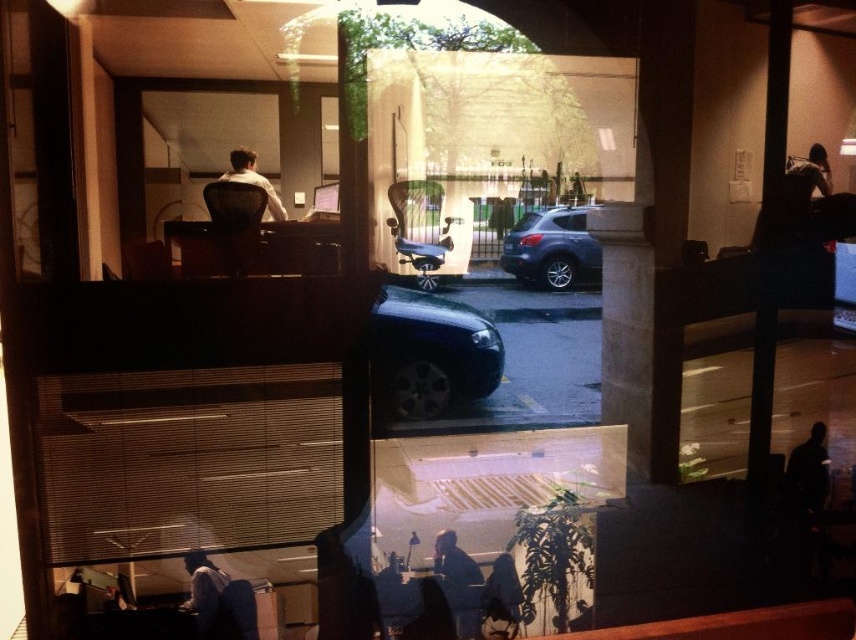
What do you see at coordinates (551, 248) in the screenshot? The width and height of the screenshot is (856, 640). I see `satin silver suv at center` at bounding box center [551, 248].

Can you confirm if satin silver suv at center is positioned to the left of silhouette figure at lower right?

Yes, satin silver suv at center is to the left of silhouette figure at lower right.

The height and width of the screenshot is (640, 856). In order to click on satin silver suv at center in this screenshot , I will do `click(551, 248)`.

Which is above, satin silver suv at center or matte white shirt at upper center?

matte white shirt at upper center is higher up.

Which is more to the left, satin silver suv at center or matte white shirt at upper center?

Positioned to the left is matte white shirt at upper center.

Does point (595, 243) lie in front of point (245, 148)?

No, it is not.

The width and height of the screenshot is (856, 640). I want to click on satin silver suv at center, so click(551, 248).

Between point (818, 499) and point (206, 621), which one is positioned behind?

The point (818, 499) is behind.

Is silhouette figure at lower right to the right of dark gray shirt at lower left from the viewer's perspective?

Correct, you'll find silhouette figure at lower right to the right of dark gray shirt at lower left.

Where is `silhouette figure at lower right`? This screenshot has width=856, height=640. silhouette figure at lower right is located at coordinates (807, 470).